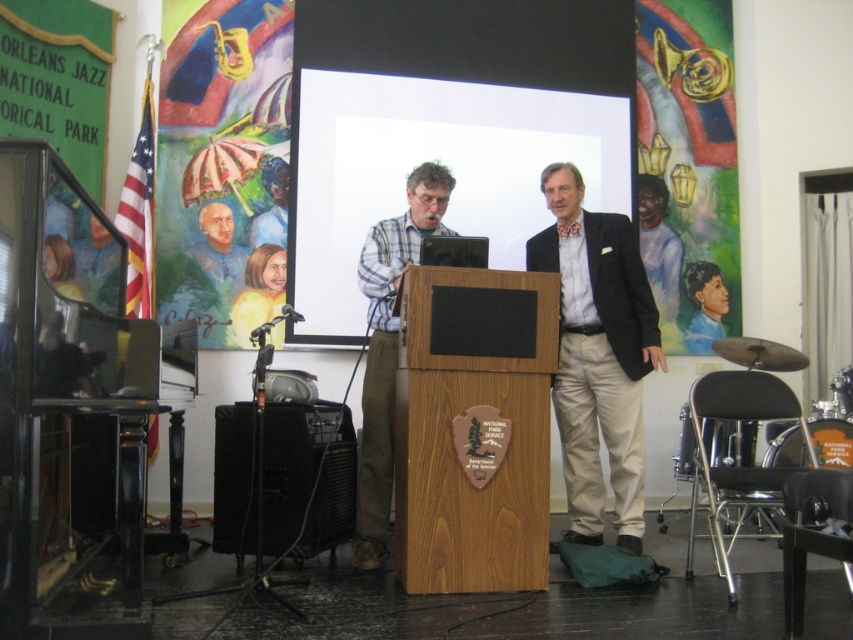
You are a photographer positioned at the camera. You need to capture a clear image of the white matte projection screen at center. Given that the camera and the screen are 15.90 feet apart, is the distance sufficient for a clear photo?

The white matte projection screen at center and camera are 15.90 feet apart. This distance is sufficient for capturing a clear image as most cameras can focus clearly at this distance.

You are an event organizer setting up for a presentation. You need to ensure that the white matte projection screen at center is visible to all attendees. Considering the dark blue shirt at center, which object is taller and needs to be positioned carefully to avoid blocking the screen?

The white matte projection screen at center is taller than the dark blue shirt at center. To ensure visibility, position the dark blue shirt at center so it does not obstruct the lower portion of the screen.